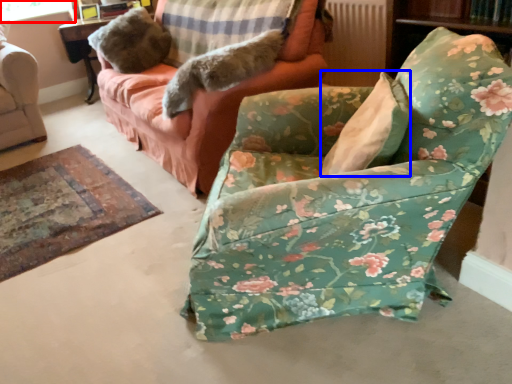
Question: Which object appears farthest to the camera in this image, window screen (highlighted by a red box) or pillow (highlighted by a blue box)?

Choices:
 (A) window screen
 (B) pillow

Answer: (A)